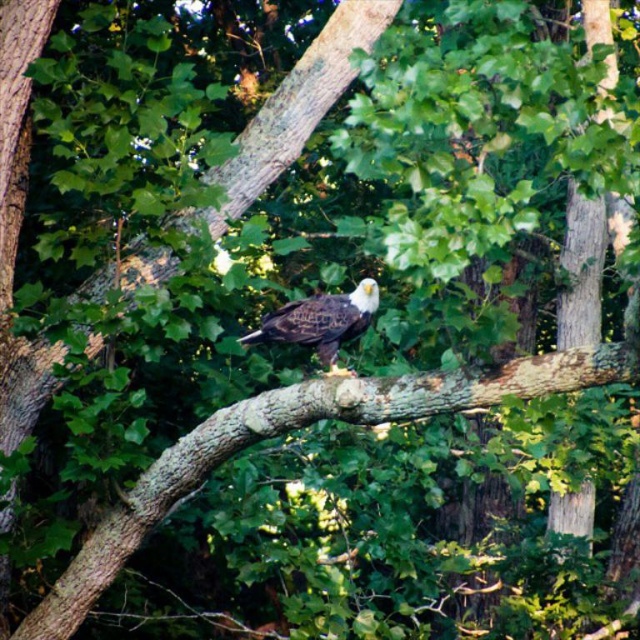
Between brown rough tree branch at center and white-feathered eagle at center, which one is positioned lower?

Positioned lower is brown rough tree branch at center.

Based on the photo, who is more forward, (131, 506) or (308, 339)?

Point (308, 339) is more forward.

Identify the location of brown rough tree branch at center. Image resolution: width=640 pixels, height=640 pixels. (294, 428).

At what (x,y) coordinates should I click in order to perform the action: click on brown rough tree branch at center. Please return your answer as a coordinate pair (x, y). The width and height of the screenshot is (640, 640). Looking at the image, I should click on (294, 428).